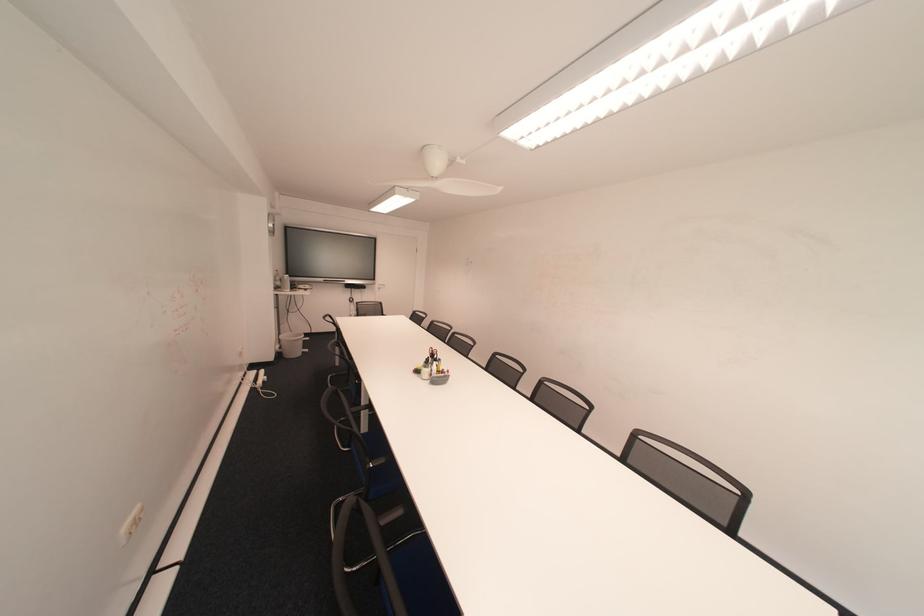
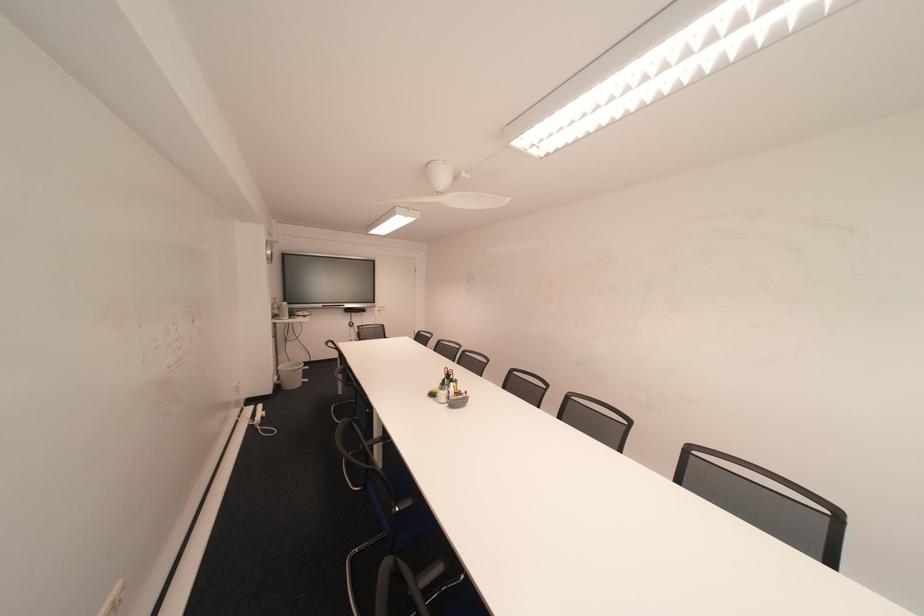
The point at (x=290, y=355) is marked in the first image. Where is the corresponding point in the second image?

(288, 387)